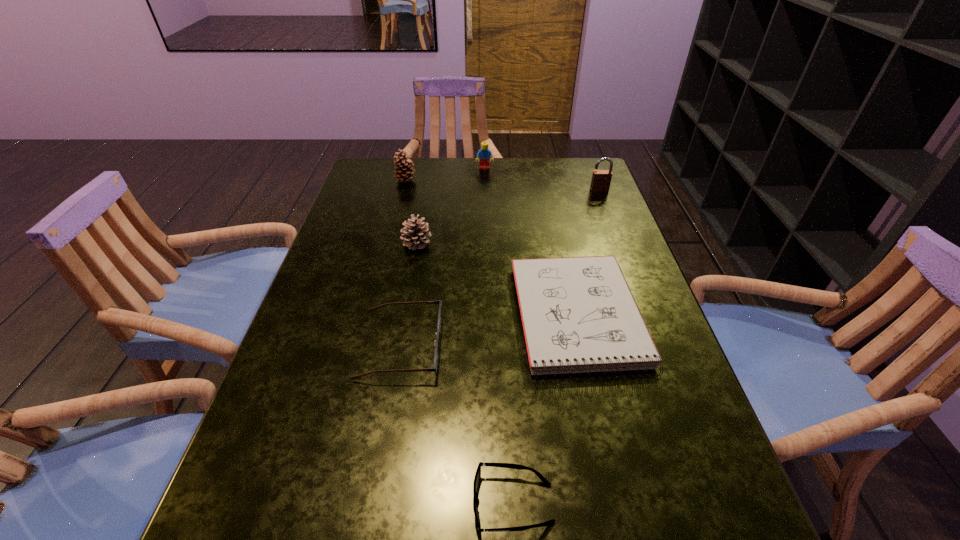
Find the location of `vacant space at the right edge of the desktop`. vacant space at the right edge of the desktop is located at coordinates (650, 535).

Find the location of a particular element. free space at the far right corner of the desktop is located at coordinates (564, 184).

This screenshot has width=960, height=540. I want to click on vacant point located between the fourth nearest object and the farther pinecone, so click(x=411, y=212).

This screenshot has width=960, height=540. In order to click on free space that is in between the Lego and the notepad in this screenshot , I will do `click(531, 242)`.

The image size is (960, 540). Identify the location of free space between the Lego and the shorter pinecone. (450, 206).

Where is `free space between the nearest object and the notepad`? free space between the nearest object and the notepad is located at coordinates (545, 410).

I want to click on vacant region between the notepad and the Lego, so click(x=531, y=242).

This screenshot has width=960, height=540. Identify the location of empty location between the nearer pinecone and the spectacles. (409, 294).

Identify the location of vacant area that lies between the spectacles and the padlock. This screenshot has height=540, width=960. (500, 267).

Where is `free space between the shortest object and the notepad`? free space between the shortest object and the notepad is located at coordinates (545, 410).